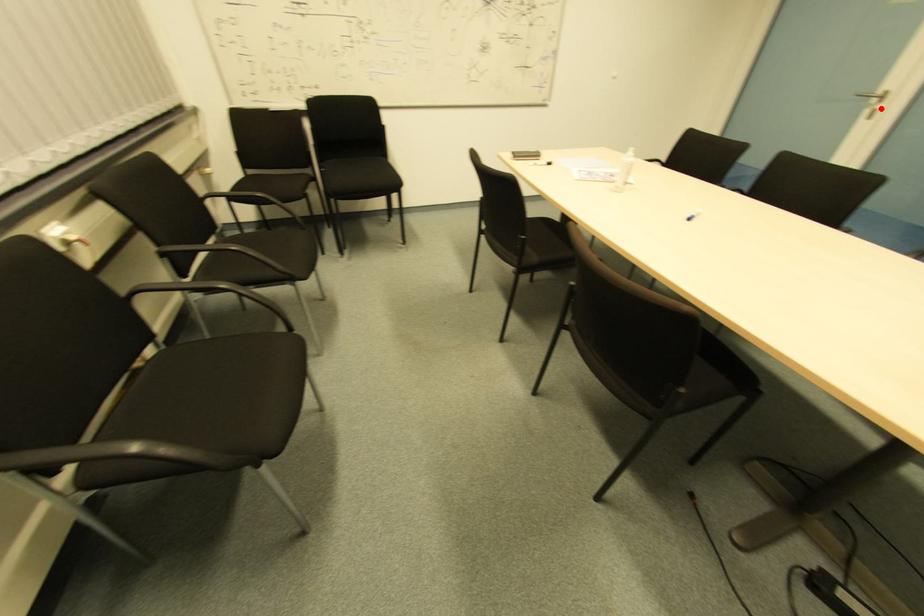
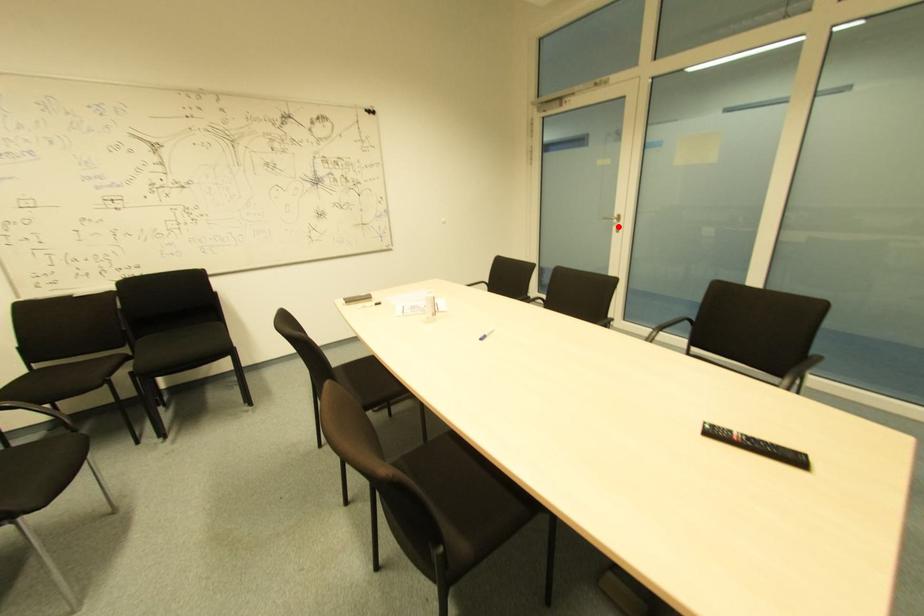
I am providing you with two images of the same scene from different viewpoints. A red point is marked on the first image and another point is marked on the second image. Does the point marked in image1 correspond to the same location as the one in image2?

Yes